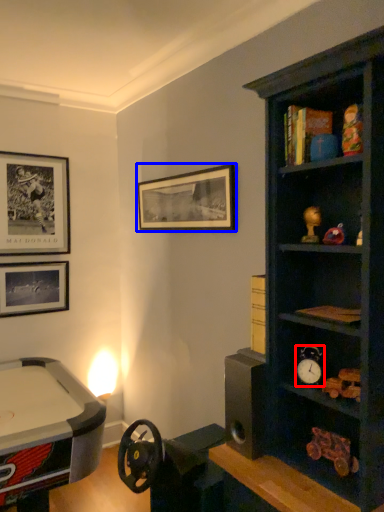
Question: Among these objects, which one is farthest to the camera, clock (highlighted by a red box) or picture frame (highlighted by a blue box)?

Choices:
 (A) clock
 (B) picture frame

Answer: (B)